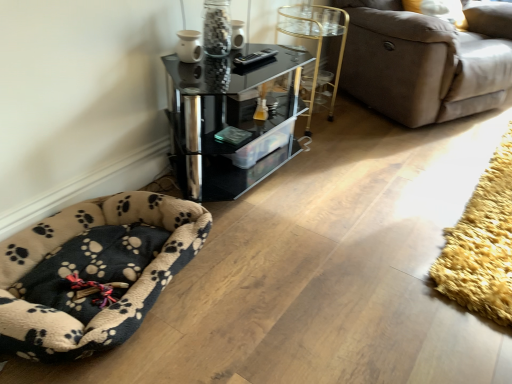
Locate an element on the screen. This screenshot has height=384, width=512. vacant space that's between brown fabric couch at upper right and yellow shaggy rug at lower right is located at coordinates (425, 170).